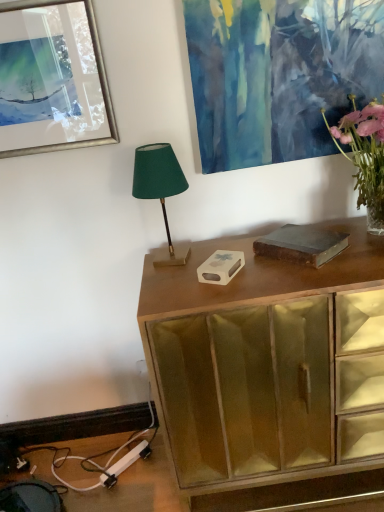
Question: Considering the relative sizes of wooden cabinet at center and pink glass vase at upper right in the image provided, is wooden cabinet at center wider than pink glass vase at upper right?

Choices:
 (A) yes
 (B) no

Answer: (A)

Question: Does wooden cabinet at center come behind pink glass vase at upper right?

Choices:
 (A) no
 (B) yes

Answer: (A)

Question: Is wooden cabinet at center at the left side of pink glass vase at upper right?

Choices:
 (A) yes
 (B) no

Answer: (A)

Question: Is pink glass vase at upper right at the back of wooden cabinet at center?

Choices:
 (A) no
 (B) yes

Answer: (A)

Question: Does wooden cabinet at center have a lesser width compared to pink glass vase at upper right?

Choices:
 (A) yes
 (B) no

Answer: (B)

Question: From a real-world perspective, relative to wooden cabinet at center, is pink glass vase at upper right vertically above or below?

Choices:
 (A) below
 (B) above

Answer: (B)

Question: Considering the relative positions of pink glass vase at upper right and wooden cabinet at center in the image provided, is pink glass vase at upper right to the left or to the right of wooden cabinet at center?

Choices:
 (A) right
 (B) left

Answer: (A)

Question: Is point (380, 134) closer or farther from the camera than point (160, 408)?

Choices:
 (A) closer
 (B) farther

Answer: (B)

Question: Considering the positions of pink glass vase at upper right and wooden cabinet at center in the image, is pink glass vase at upper right wider or thinner than wooden cabinet at center?

Choices:
 (A) wide
 (B) thin

Answer: (B)

Question: In terms of height, does wooden cabinet at center look taller or shorter compared to metallic silver picture frame at upper left?

Choices:
 (A) tall
 (B) short

Answer: (A)

Question: Does point (193, 460) appear closer or farther from the camera than point (117, 138)?

Choices:
 (A) closer
 (B) farther

Answer: (A)

Question: Do you think wooden cabinet at center is within metallic silver picture frame at upper left, or outside of it?

Choices:
 (A) inside
 (B) outside

Answer: (B)

Question: From the image's perspective, is wooden cabinet at center positioned above or below metallic silver picture frame at upper left?

Choices:
 (A) below
 (B) above

Answer: (A)

Question: In terms of size, does pink glass vase at upper right appear bigger or smaller than green fabric lampshade at center?

Choices:
 (A) big
 (B) small

Answer: (A)

Question: From the image's perspective, relative to green fabric lampshade at center, is pink glass vase at upper right above or below?

Choices:
 (A) above
 (B) below

Answer: (A)